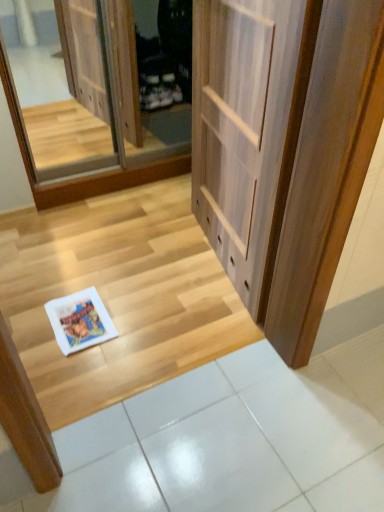
The width and height of the screenshot is (384, 512). Identify the location of blank area beneath light wood door at center (from a real-world perspective). 214,261.